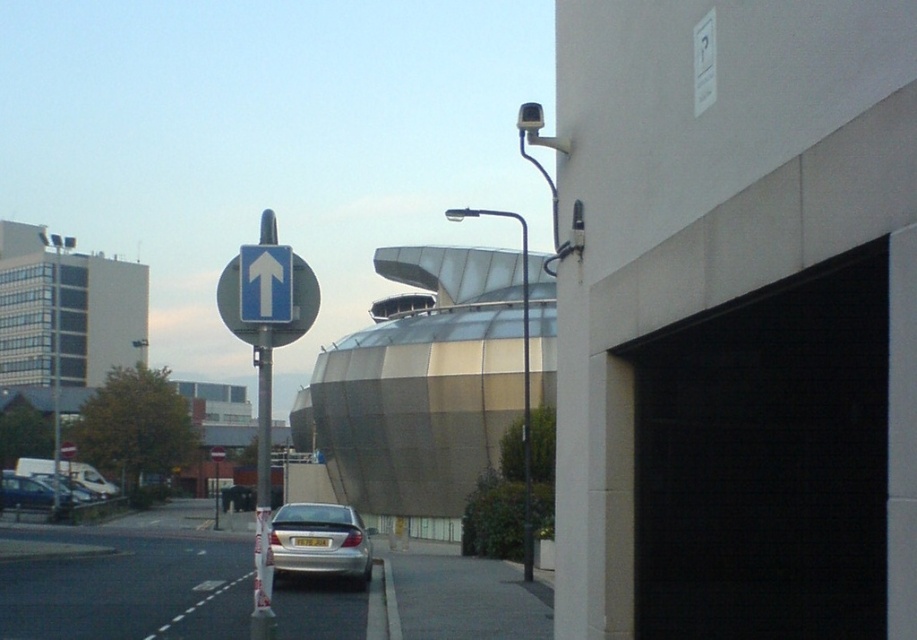
Can you confirm if smooth asphalt road at lower left is bigger than blue glossy sign at upper left?

No.

Can you confirm if smooth asphalt road at lower left is wider than blue glossy sign at upper left?

Yes.

The image size is (917, 640). What do you see at coordinates (127, 588) in the screenshot?
I see `smooth asphalt road at lower left` at bounding box center [127, 588].

Identify the location of smooth asphalt road at lower left. Image resolution: width=917 pixels, height=640 pixels. (127, 588).

Is silver metallic car at lower center above metallic silver car at lower left?

Yes.

Who is more forward, (275, 538) or (14, 484)?

Point (275, 538) is more forward.

Image resolution: width=917 pixels, height=640 pixels. What are the coordinates of `silver metallic car at lower center` in the screenshot? It's located at (319, 541).

Is blue glossy arrow at upper center above metallic silver car at lower left?

Yes.

Who is lower down, blue glossy arrow at upper center or metallic silver car at lower left?

Positioned lower is metallic silver car at lower left.

Between point (264, 266) and point (45, 484), which one is positioned behind?

The point (45, 484) is more distant.

Locate an element on the screen. blue glossy arrow at upper center is located at coordinates (264, 284).